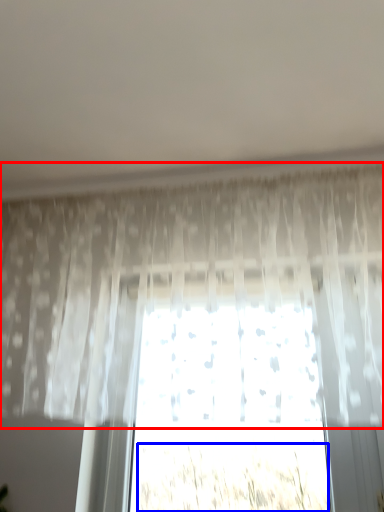
Question: Which of the following is the closest to the observer, curtain (highlighted by a red box) or plant (highlighted by a blue box)?

Choices:
 (A) curtain
 (B) plant

Answer: (A)